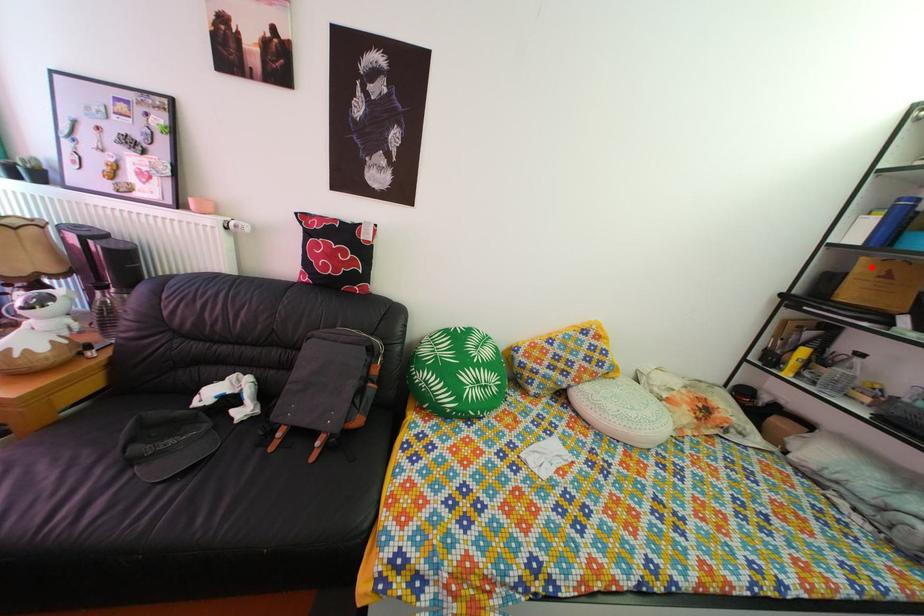
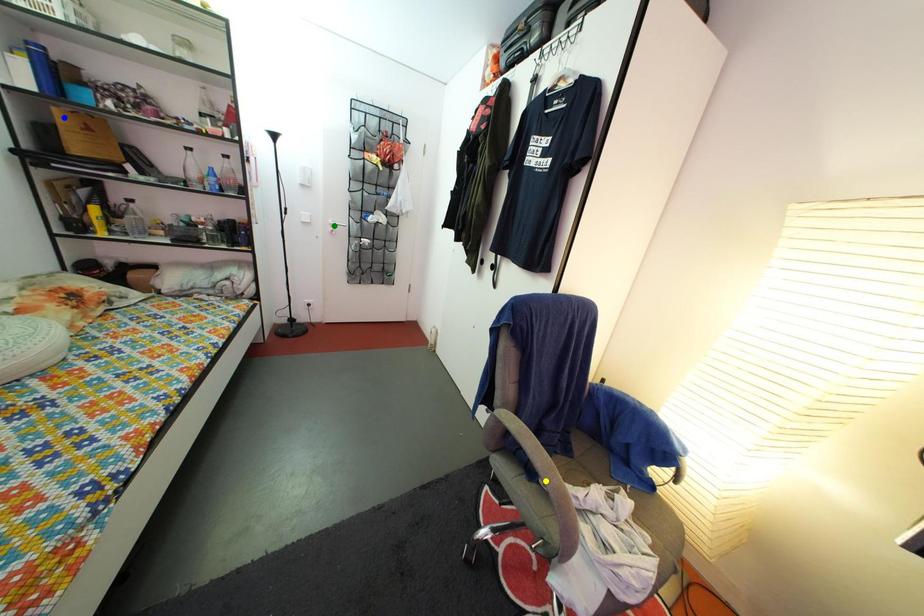
Question: I am providing you with two images of the same scene from different viewpoints. A red point is marked on the first image. You are given multiple points on the second image. Which point in image 2 is actually the same real-world point as the red point in image 1?

Choices:
 (A) yellow point
 (B) green point
 (C) blue point

Answer: (C)